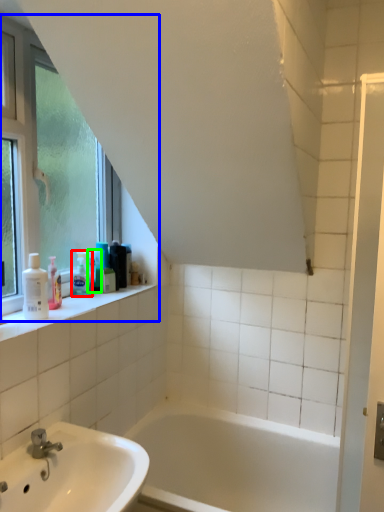
Question: Which object is positioned closest to toiletry (highlighted by a red box)? Select from window (highlighted by a blue box) and toiletry (highlighted by a green box).

Choices:
 (A) window
 (B) toiletry

Answer: (B)